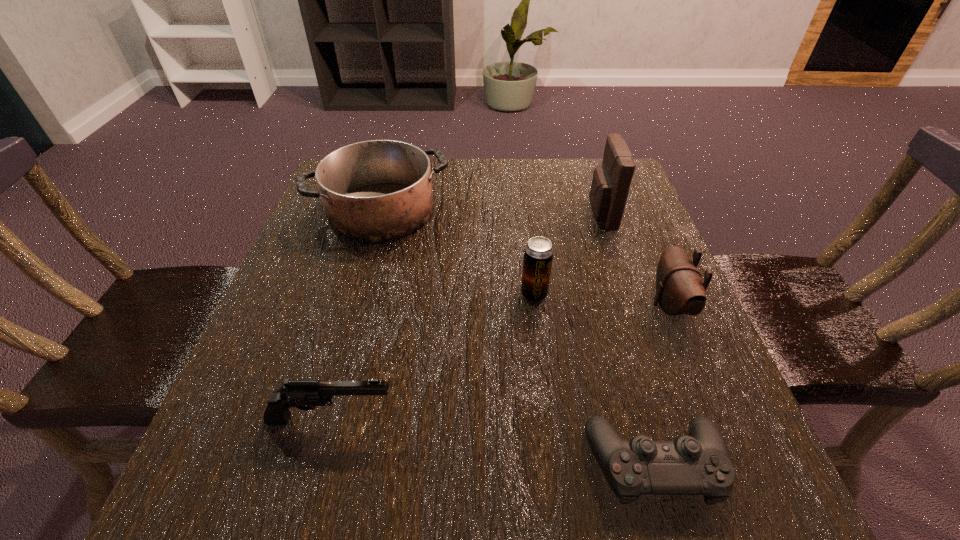
Identify the location of the taller pouch. The height and width of the screenshot is (540, 960). (611, 181).

Locate an element on the screen. The height and width of the screenshot is (540, 960). the tallest object is located at coordinates (611, 181).

This screenshot has width=960, height=540. Find the location of `beer can`. beer can is located at coordinates (538, 253).

Find the location of `saucepan`. saucepan is located at coordinates (379, 190).

The width and height of the screenshot is (960, 540). In order to click on the right pouch in this screenshot , I will do `click(680, 290)`.

Where is `the nearer pouch`? The image size is (960, 540). the nearer pouch is located at coordinates (680, 290).

Where is `gun`? Image resolution: width=960 pixels, height=540 pixels. gun is located at coordinates pos(303,394).

You are a GUI agent. You are given a task and a screenshot of the screen. Output one action in this format:
    pyautogui.click(x=<x>, y=<y>)
    Task: Click on the shortest object
    The width and height of the screenshot is (960, 540).
    Given the screenshot: What is the action you would take?
    pyautogui.click(x=698, y=464)

You are a GUI agent. You are given a task and a screenshot of the screen. Output one action in this format:
    pyautogui.click(x=<x>, y=<y>)
    Task: Click on the blank area located 0.290m with an open flap on the left pouch
    The height and width of the screenshot is (540, 960).
    Given the screenshot: What is the action you would take?
    pos(466,214)

In order to click on free space located 0.050m with an open flap on the left pouch in this screenshot , I will do `click(567, 214)`.